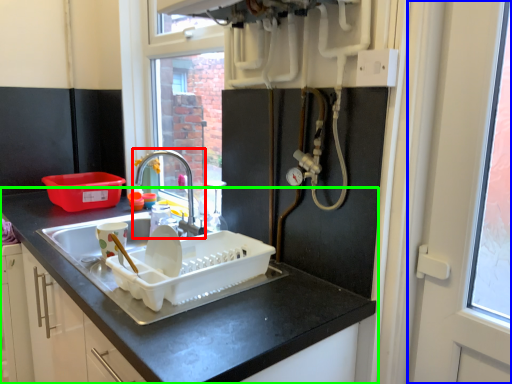
Question: Which is nearer to the tap (highlighted by a red box)? screen door (highlighted by a blue box) or countertop (highlighted by a green box).

Choices:
 (A) screen door
 (B) countertop

Answer: (B)